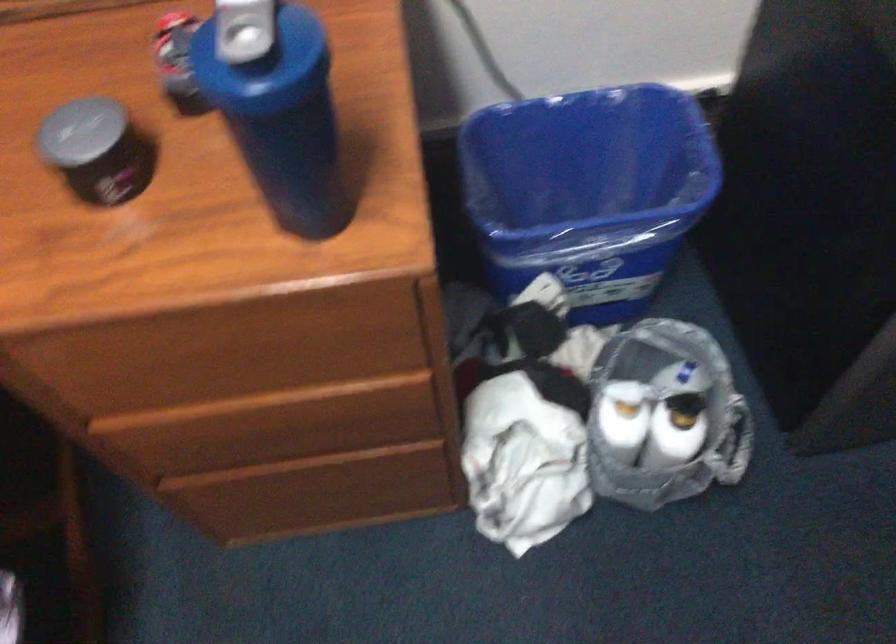
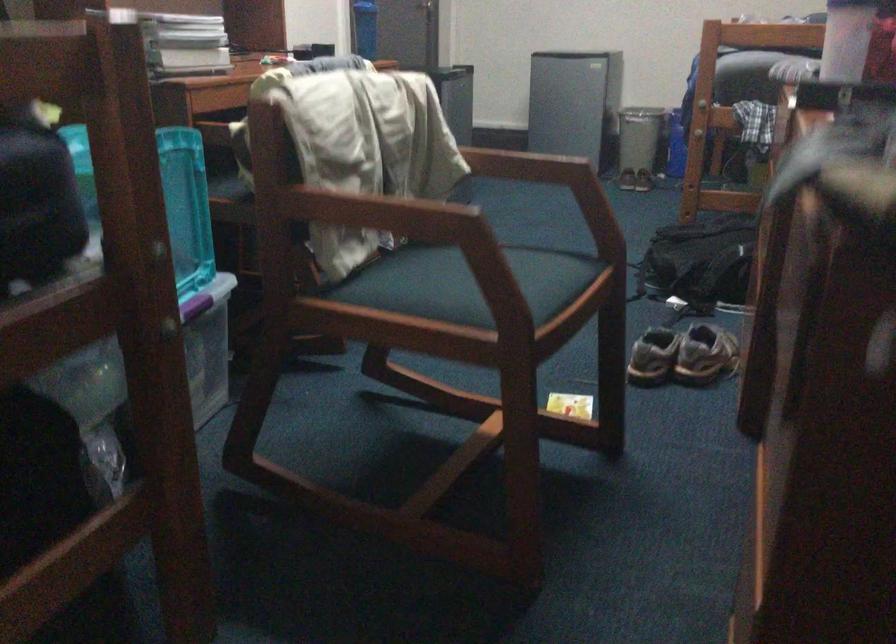
Question: I am providing you with two images of the same scene from different viewpoints. After the viewpoint changes to image2, which objects are now occluded?

Choices:
 (A) black backpack
 (B) yellow bag handle
 (C) wooden chair armrest
 (D) drawer handle

Answer: (D)